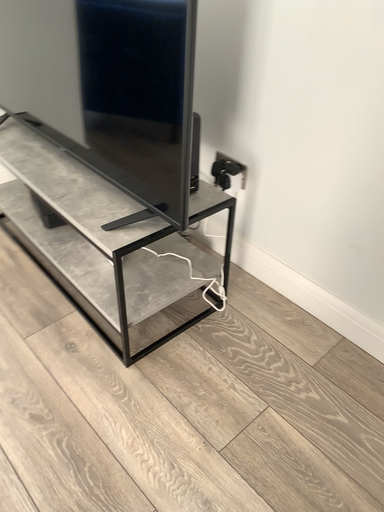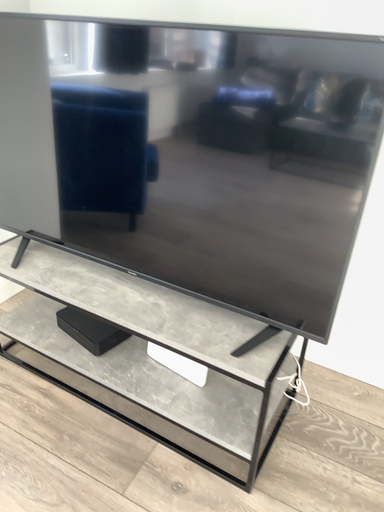
Question: How did the camera likely rotate when shooting the video?

Choices:
 (A) rotated right
 (B) rotated left

Answer: (A)